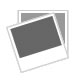
Identify the location of area to left of pictures. click(x=3, y=46).